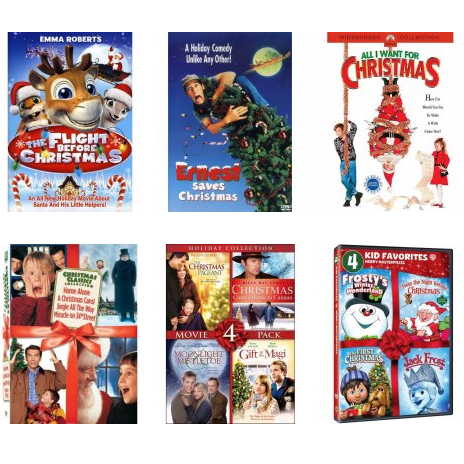
Locate an element on the screen. The height and width of the screenshot is (464, 464). christmas trees is located at coordinates (378, 369), (239, 381), (221, 304), (238, 312), (260, 160).